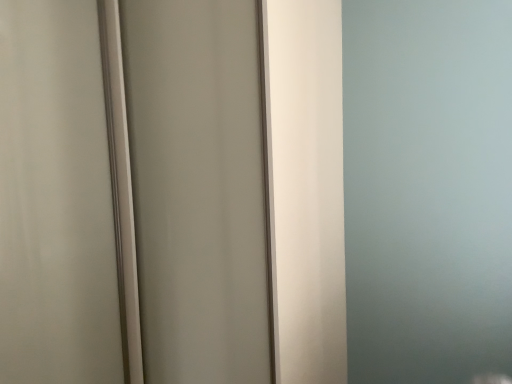
Image resolution: width=512 pixels, height=384 pixels. Find the location of `matte white screen door at center, marked as the first screen door in a right-to-left arrangement`. matte white screen door at center, marked as the first screen door in a right-to-left arrangement is located at coordinates (198, 188).

This screenshot has height=384, width=512. What do you see at coordinates (198, 188) in the screenshot? I see `matte white screen door at center, which is counted as the second screen door, starting from the left` at bounding box center [198, 188].

Describe the element at coordinates (55, 199) in the screenshot. I see `white glossy screen door at center, which is counted as the second screen door, starting from the right` at that location.

How much space does white glossy screen door at center, which ranks as the first screen door in left-to-right order, occupy vertically?

The height of white glossy screen door at center, which ranks as the first screen door in left-to-right order, is 1.91 meters.

Where is `white glossy screen door at center, which ranks as the first screen door in left-to-right order`? white glossy screen door at center, which ranks as the first screen door in left-to-right order is located at coordinates (55, 199).

Where is `matte white screen door at center, marked as the first screen door in a right-to-left arrangement`? The image size is (512, 384). matte white screen door at center, marked as the first screen door in a right-to-left arrangement is located at coordinates (198, 188).

Between matte white screen door at center, marked as the first screen door in a right-to-left arrangement, and white glossy screen door at center, which ranks as the first screen door in left-to-right order, which one appears on the left side from the viewer's perspective?

white glossy screen door at center, which ranks as the first screen door in left-to-right order.

Is matte white screen door at center, marked as the first screen door in a right-to-left arrangement, behind white glossy screen door at center, which is counted as the second screen door, starting from the right?

Yes, matte white screen door at center, marked as the first screen door in a right-to-left arrangement, is further from the viewer.

Is point (169, 239) farther from viewer compared to point (61, 127)?

Yes, point (169, 239) is farther from viewer.

From the image's perspective, between matte white screen door at center, marked as the first screen door in a right-to-left arrangement, and white glossy screen door at center, which ranks as the first screen door in left-to-right order, which one is located above?

matte white screen door at center, marked as the first screen door in a right-to-left arrangement, appears higher in the image.

From a real-world perspective, between matte white screen door at center, which is counted as the second screen door, starting from the left, and white glossy screen door at center, which ranks as the first screen door in left-to-right order, who is vertically higher?

white glossy screen door at center, which ranks as the first screen door in left-to-right order, from a real-world perspective.

In terms of width, does matte white screen door at center, which is counted as the second screen door, starting from the left, look wider or thinner when compared to white glossy screen door at center, which ranks as the first screen door in left-to-right order?

Considering their sizes, matte white screen door at center, which is counted as the second screen door, starting from the left, looks slimmer than white glossy screen door at center, which ranks as the first screen door in left-to-right order.

Does matte white screen door at center, marked as the first screen door in a right-to-left arrangement, have a lesser height compared to white glossy screen door at center, which is counted as the second screen door, starting from the right?

No, matte white screen door at center, marked as the first screen door in a right-to-left arrangement, is not shorter than white glossy screen door at center, which is counted as the second screen door, starting from the right.

Based on their sizes in the image, would you say matte white screen door at center, marked as the first screen door in a right-to-left arrangement, is bigger or smaller than white glossy screen door at center, which is counted as the second screen door, starting from the right?

matte white screen door at center, marked as the first screen door in a right-to-left arrangement, is bigger than white glossy screen door at center, which is counted as the second screen door, starting from the right.

Consider the image. Is white glossy screen door at center, which ranks as the first screen door in left-to-right order, a part of matte white screen door at center, marked as the first screen door in a right-to-left arrangement?

Actually, white glossy screen door at center, which ranks as the first screen door in left-to-right order, is outside matte white screen door at center, marked as the first screen door in a right-to-left arrangement.

Are matte white screen door at center, which is counted as the second screen door, starting from the left, and white glossy screen door at center, which is counted as the second screen door, starting from the right, far apart?

No, there isn't a large distance between matte white screen door at center, which is counted as the second screen door, starting from the left, and white glossy screen door at center, which is counted as the second screen door, starting from the right.

Could you tell me if matte white screen door at center, which is counted as the second screen door, starting from the left, is facing white glossy screen door at center, which ranks as the first screen door in left-to-right order?

Yes, matte white screen door at center, which is counted as the second screen door, starting from the left, faces towards white glossy screen door at center, which ranks as the first screen door in left-to-right order.

How different are the orientations of matte white screen door at center, which is counted as the second screen door, starting from the left, and white glossy screen door at center, which is counted as the second screen door, starting from the right, in degrees?

There is a 89.9-degree angle between the facing directions of matte white screen door at center, which is counted as the second screen door, starting from the left, and white glossy screen door at center, which is counted as the second screen door, starting from the right.

Where is `screen door lying above the white glossy screen door at center, which is counted as the second screen door, starting from the right (from the image's perspective)`? The image size is (512, 384). screen door lying above the white glossy screen door at center, which is counted as the second screen door, starting from the right (from the image's perspective) is located at coordinates (198, 188).

Considering the relative positions of white glossy screen door at center, which is counted as the second screen door, starting from the right, and matte white screen door at center, which is counted as the second screen door, starting from the left, in the image provided, is white glossy screen door at center, which is counted as the second screen door, starting from the right, to the left or to the right of matte white screen door at center, which is counted as the second screen door, starting from the left,?

Clearly, white glossy screen door at center, which is counted as the second screen door, starting from the right, is on the left of matte white screen door at center, which is counted as the second screen door, starting from the left, in the image.

Which is behind, white glossy screen door at center, which is counted as the second screen door, starting from the right, or matte white screen door at center, which is counted as the second screen door, starting from the left?

matte white screen door at center, which is counted as the second screen door, starting from the left, is further from the camera.

Which is closer, (45, 259) or (191, 195)?

Point (45, 259) is closer to the camera than point (191, 195).

From the image's perspective, is white glossy screen door at center, which ranks as the first screen door in left-to-right order, above or below matte white screen door at center, which is counted as the second screen door, starting from the left?

Clearly, from the image's perspective, white glossy screen door at center, which ranks as the first screen door in left-to-right order, is below matte white screen door at center, which is counted as the second screen door, starting from the left.

From a real-world perspective, is white glossy screen door at center, which ranks as the first screen door in left-to-right order, beneath matte white screen door at center, marked as the first screen door in a right-to-left arrangement?

Incorrect, from a real-world perspective, white glossy screen door at center, which ranks as the first screen door in left-to-right order, is higher than matte white screen door at center, marked as the first screen door in a right-to-left arrangement.

Is white glossy screen door at center, which ranks as the first screen door in left-to-right order, wider or thinner than matte white screen door at center, which is counted as the second screen door, starting from the left?

white glossy screen door at center, which ranks as the first screen door in left-to-right order, is wider than matte white screen door at center, which is counted as the second screen door, starting from the left.

In terms of height, does white glossy screen door at center, which is counted as the second screen door, starting from the right, look taller or shorter compared to matte white screen door at center, marked as the first screen door in a right-to-left arrangement?

In the image, white glossy screen door at center, which is counted as the second screen door, starting from the right, appears to be shorter than matte white screen door at center, marked as the first screen door in a right-to-left arrangement.

Who is smaller, white glossy screen door at center, which is counted as the second screen door, starting from the right, or matte white screen door at center, which is counted as the second screen door, starting from the left?

With smaller size is white glossy screen door at center, which is counted as the second screen door, starting from the right.

Which is correct: white glossy screen door at center, which is counted as the second screen door, starting from the right, is inside matte white screen door at center, which is counted as the second screen door, starting from the left, or outside of it?

The correct answer is: outside.

Looking at this image, would you say white glossy screen door at center, which ranks as the first screen door in left-to-right order, is a long distance from matte white screen door at center, which is counted as the second screen door, starting from the left?

They are positioned close to each other.

Is white glossy screen door at center, which ranks as the first screen door in left-to-right order, aimed at matte white screen door at center, marked as the first screen door in a right-to-left arrangement?

No, white glossy screen door at center, which ranks as the first screen door in left-to-right order, is not turned towards matte white screen door at center, marked as the first screen door in a right-to-left arrangement.

Where is `screen door below the matte white screen door at center, marked as the first screen door in a right-to-left arrangement (from the image's perspective)`? screen door below the matte white screen door at center, marked as the first screen door in a right-to-left arrangement (from the image's perspective) is located at coordinates (55, 199).

Where is `screen door below the matte white screen door at center, which is counted as the second screen door, starting from the left (from the image's perspective)`? The image size is (512, 384). screen door below the matte white screen door at center, which is counted as the second screen door, starting from the left (from the image's perspective) is located at coordinates [55, 199].

The height and width of the screenshot is (384, 512). Find the location of `screen door that is in front of the matte white screen door at center, which is counted as the second screen door, starting from the left`. screen door that is in front of the matte white screen door at center, which is counted as the second screen door, starting from the left is located at coordinates (55, 199).